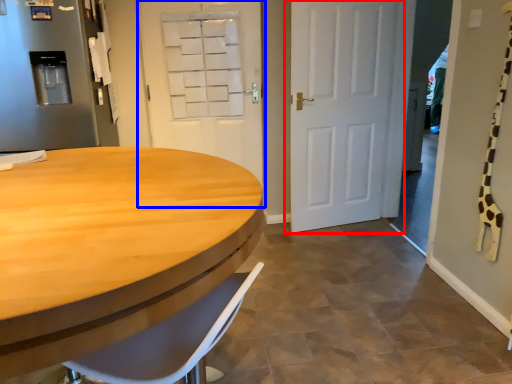
Question: Which object appears farthest to the camera in this image, door (highlighted by a red box) or door (highlighted by a blue box)?

Choices:
 (A) door
 (B) door

Answer: (B)